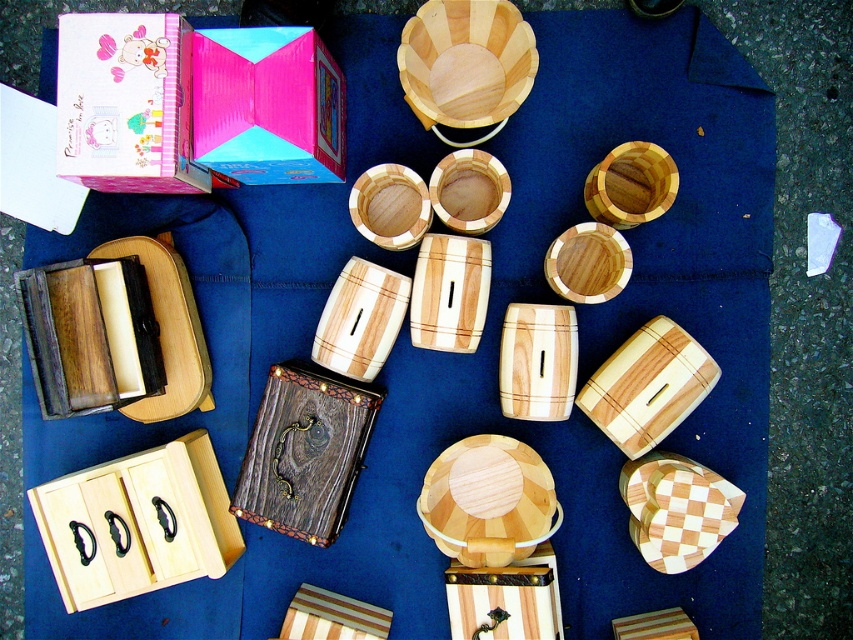
In the scene shown: You are a customer at the flea market and want to place a small item between the pink matte box at upper left and the striped wooden cylinder at lower right. Is there enough space between them to fit the item?

The pink matte box at upper left and the striped wooden cylinder at lower right are 1.18 meters apart, so there is sufficient space to place a small item between them.

What is located at the coordinates point (137, 524)?

The natural wood drawer at lower left is located at point (137, 524).

You are setting up a display for a flea market and need to place the natural wood drawer at lower left and the pink matte box at upper left on a shelf. Which object should you place first if you want to ensure there is enough space for both?

You should place the natural wood drawer at lower left first because it has a larger size compared to the pink matte box at upper left, ensuring there is enough space for both.